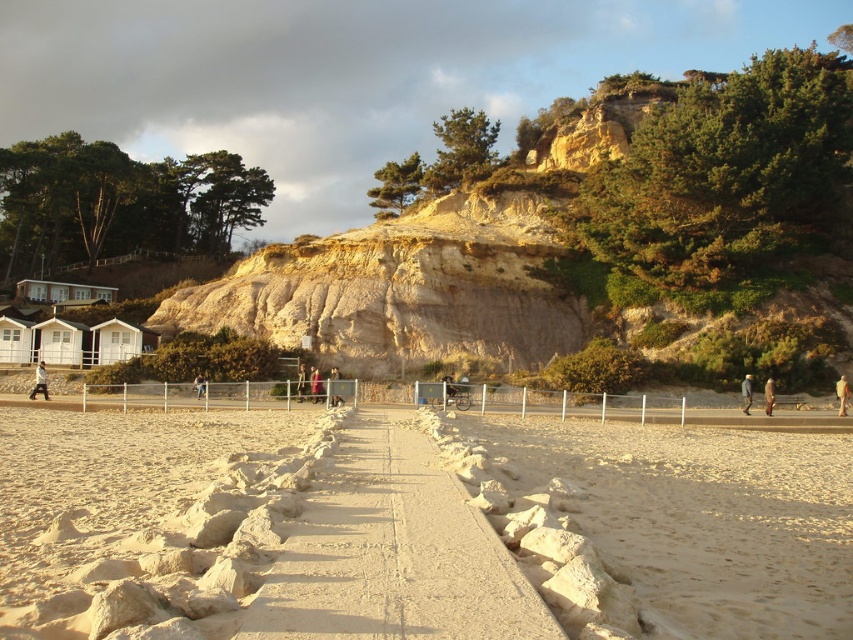
You are a photographer planning to take a photo of the yellowish sandstone cliff at upper center and the light brown fur coat at right. Which object will appear larger in the photo?

The yellowish sandstone cliff at upper center will appear larger in the photo because it is taller than the light brown fur coat at right.

You are a beachgoer who wants to place your dark blue jacket at right on the beige sand at center. Will the jacket be visible from above when placed there?

The beige sand at center is not as tall as dark blue jacket at right, so the jacket will be visible from above when placed there.